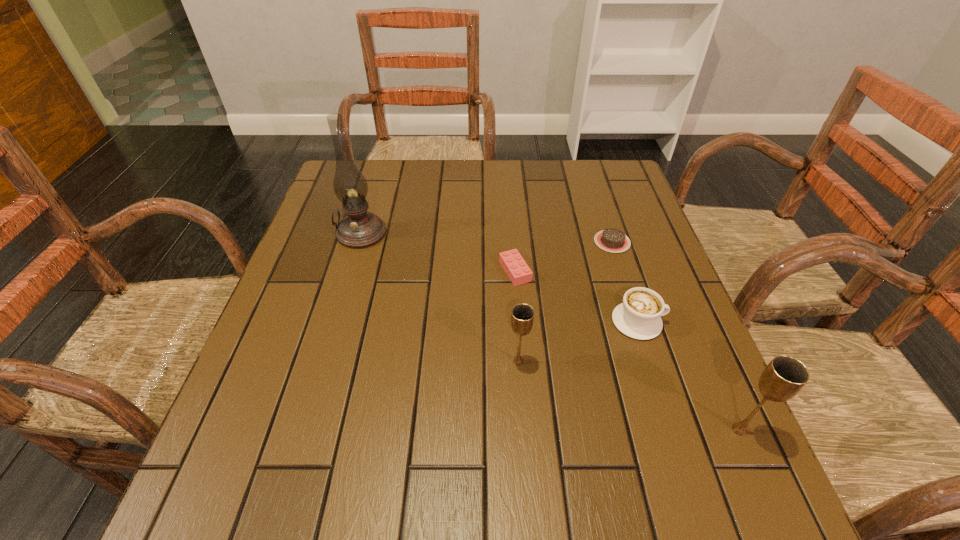
Find the location of a particular element. the fifth farthest object is located at coordinates (522, 317).

Image resolution: width=960 pixels, height=540 pixels. What are the coordinates of `the shorter chalice` in the screenshot? It's located at tap(522, 317).

Image resolution: width=960 pixels, height=540 pixels. Find the location of `the rightmost object`. the rightmost object is located at coordinates (784, 376).

Find the location of a particular element. the second tallest object is located at coordinates (784, 376).

The image size is (960, 540). I want to click on Lego, so click(x=518, y=271).

The image size is (960, 540). Identify the location of the third farthest object. (518, 271).

Locate an element on the screen. chocolate cake is located at coordinates (613, 240).

The height and width of the screenshot is (540, 960). Identify the location of the tallest object. (359, 229).

Identify the location of the leftmost object. The height and width of the screenshot is (540, 960). (359, 229).

You are a GUI agent. You are given a task and a screenshot of the screen. Output one action in this format:
    pyautogui.click(x=<x>, y=<y>)
    Task: Click on the cappuccino
    The width and height of the screenshot is (960, 540).
    Given the screenshot: What is the action you would take?
    pyautogui.click(x=638, y=316)